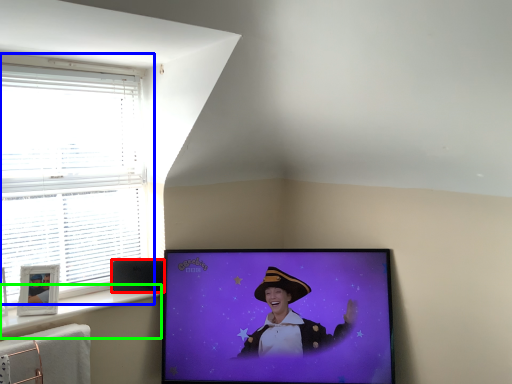
Question: Considering the real-world distances, which object is farthest from speaker (highlighted by a red box)? window (highlighted by a blue box) or window sill (highlighted by a green box)?

Choices:
 (A) window
 (B) window sill

Answer: (A)